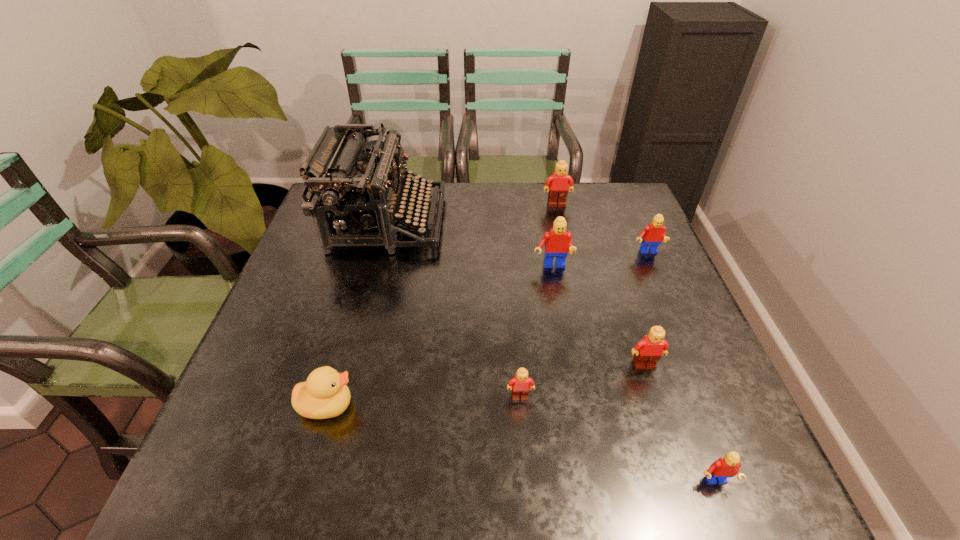
Identify the location of free space located 0.190m on the face of the fifth farthest Lego. (528, 502).

Locate an element on the screen. The image size is (960, 540). typewriter at the far edge is located at coordinates (355, 200).

This screenshot has height=540, width=960. Identify the location of Lego situated at the far edge. (558, 189).

Locate an element on the screen. The height and width of the screenshot is (540, 960). object located in the near edge section of the desktop is located at coordinates (725, 467).

Where is `typewriter situated at the left edge`? The height and width of the screenshot is (540, 960). typewriter situated at the left edge is located at coordinates (355, 200).

Find the location of a particular element. duckling at the left edge is located at coordinates (325, 394).

Identify the location of object located at the far left corner. (355, 200).

Locate an element on the screen. object present at the near right corner is located at coordinates (725, 467).

You are a GUI agent. You are given a task and a screenshot of the screen. Output one action in this format:
    pyautogui.click(x=<x>, y=<y>)
    Task: Click on the free location at the far edge
    This screenshot has height=540, width=960.
    Given the screenshot: What is the action you would take?
    pyautogui.click(x=456, y=208)

This screenshot has height=540, width=960. I want to click on vacant region at the near edge, so click(x=328, y=488).